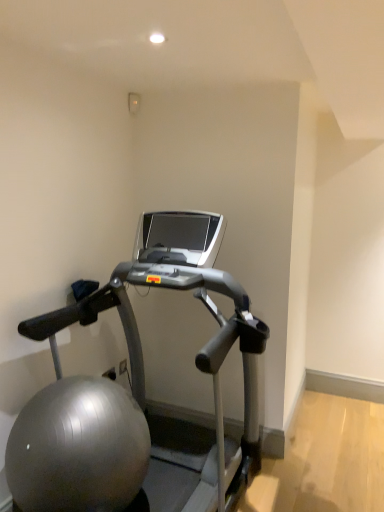
At what (x,y) coordinates should I click in order to perform the action: click on silver metallic treadmill at center. Please return your answer as a coordinate pair (x, y). The width and height of the screenshot is (384, 512). Looking at the image, I should click on (138, 393).

The image size is (384, 512). What do you see at coordinates (138, 393) in the screenshot?
I see `silver metallic treadmill at center` at bounding box center [138, 393].

I want to click on silver metallic treadmill at center, so click(138, 393).